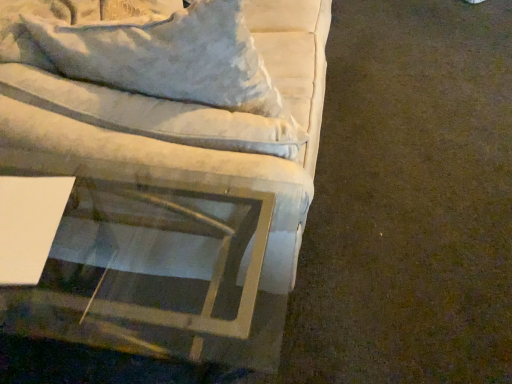
This screenshot has width=512, height=384. What do you see at coordinates (172, 98) in the screenshot?
I see `velvet white couch at upper left` at bounding box center [172, 98].

Image resolution: width=512 pixels, height=384 pixels. Find the location of `velvet white couch at upper left`. velvet white couch at upper left is located at coordinates (172, 98).

Find the location of a particular element. The width and height of the screenshot is (512, 384). clear glass table at lower left is located at coordinates click(x=156, y=277).

The width and height of the screenshot is (512, 384). What do you see at coordinates (156, 277) in the screenshot? I see `clear glass table at lower left` at bounding box center [156, 277].

Where is `velvet white couch at upper left`? This screenshot has height=384, width=512. velvet white couch at upper left is located at coordinates (172, 98).

Is velvet white couch at upper left to the left or to the right of clear glass table at lower left in the image?

velvet white couch at upper left is positioned on clear glass table at lower left's right side.

Considering their positions, is velvet white couch at upper left located in front of or behind clear glass table at lower left?

velvet white couch at upper left is behind clear glass table at lower left.

Is point (37, 86) closer to camera compared to point (110, 240)?

Yes, point (37, 86) is in front of point (110, 240).

From the image's perspective, does velvet white couch at upper left appear higher than clear glass table at lower left?

Yes.

From a real-world perspective, between velvet white couch at upper left and clear glass table at lower left, who is vertically lower?

clear glass table at lower left, from a real-world perspective.

Looking at this image, considering the relative sizes of velvet white couch at upper left and clear glass table at lower left in the image provided, is velvet white couch at upper left wider than clear glass table at lower left?

Incorrect, the width of velvet white couch at upper left does not surpass that of clear glass table at lower left.

Is velvet white couch at upper left taller or shorter than clear glass table at lower left?

Clearly, velvet white couch at upper left is shorter compared to clear glass table at lower left.

Considering the relative sizes of velvet white couch at upper left and clear glass table at lower left in the image provided, is velvet white couch at upper left smaller than clear glass table at lower left?

Correct, velvet white couch at upper left occupies less space than clear glass table at lower left.

Looking at this image, would you say velvet white couch at upper left is outside clear glass table at lower left?

Yes, velvet white couch at upper left is outside of clear glass table at lower left.

Is velvet white couch at upper left not near clear glass table at lower left?

No, velvet white couch at upper left is not far from clear glass table at lower left.

Could you tell me if velvet white couch at upper left is turned towards clear glass table at lower left?

No, velvet white couch at upper left is not turned towards clear glass table at lower left.

Can you tell me how much velvet white couch at upper left and clear glass table at lower left differ in facing direction?

A: The angular difference between velvet white couch at upper left and clear glass table at lower left is 88.3 degrees.

Based on the photo, how far apart are velvet white couch at upper left and clear glass table at lower left?

velvet white couch at upper left and clear glass table at lower left are 9.80 inches apart.

At what (x,y) coordinates should I click in order to perform the action: click on studio couch above the clear glass table at lower left (from the image's perspective). Please return your answer as a coordinate pair (x, y). This screenshot has width=512, height=384. Looking at the image, I should click on (172, 98).

Based on their positions, is clear glass table at lower left located to the left or right of velvet white couch at upper left?

Based on their positions, clear glass table at lower left is located to the left of velvet white couch at upper left.

Is the position of clear glass table at lower left less distant than that of velvet white couch at upper left?

That is True.

Considering the positions of point (133, 276) and point (70, 13), is point (133, 276) closer or farther from the camera than point (70, 13)?

Clearly, point (133, 276) is more distant from the camera than point (70, 13).

From the image's perspective, relative to velvet white couch at upper left, is clear glass table at lower left above or below?

Clearly, from the image's perspective, clear glass table at lower left is below velvet white couch at upper left.

From a real-world perspective, is clear glass table at lower left on top of velvet white couch at upper left?

No, from a real-world perspective, clear glass table at lower left is not on top of velvet white couch at upper left.

Looking at their sizes, would you say clear glass table at lower left is wider or thinner than velvet white couch at upper left?

Considering their sizes, clear glass table at lower left looks broader than velvet white couch at upper left.

Considering the sizes of objects clear glass table at lower left and velvet white couch at upper left in the image provided, who is taller, clear glass table at lower left or velvet white couch at upper left?

With more height is clear glass table at lower left.

Does clear glass table at lower left have a smaller size compared to velvet white couch at upper left?

No.

Is velvet white couch at upper left a part of clear glass table at lower left?

No, velvet white couch at upper left is not a part of clear glass table at lower left.

Is clear glass table at lower left next to velvet white couch at upper left?

No, clear glass table at lower left is not touching velvet white couch at upper left.

Is clear glass table at lower left looking in the opposite direction of velvet white couch at upper left?

No, velvet white couch at upper left is not at the back of clear glass table at lower left.

How far apart are clear glass table at lower left and velvet white couch at upper left?

9.80 inches.

Find the location of a particular element. This screenshot has height=384, width=512. round table on the left of velvet white couch at upper left is located at coordinates (156, 277).

Locate an element on the screen. Image resolution: width=512 pixels, height=384 pixels. round table that is on the left side of velvet white couch at upper left is located at coordinates pyautogui.click(x=156, y=277).

Find the location of a particular element. The width and height of the screenshot is (512, 384). round table located in front of the velvet white couch at upper left is located at coordinates (156, 277).